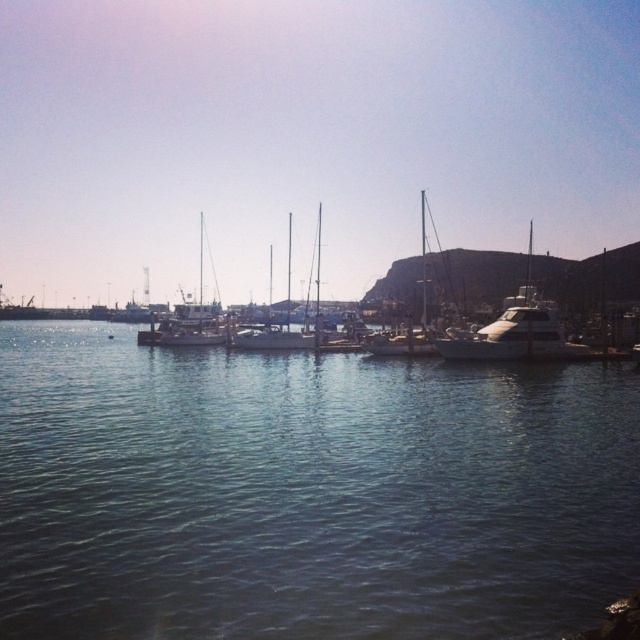
Question: Is clear water at center in front of white glossy yacht at center?

Choices:
 (A) no
 (B) yes

Answer: (B)

Question: Is clear water at center to the left of white glossy yacht at center from the viewer's perspective?

Choices:
 (A) no
 (B) yes

Answer: (B)

Question: Which object is farther from the camera taking this photo?

Choices:
 (A) clear water at center
 (B) white glossy yacht at center

Answer: (B)

Question: Does clear water at center have a larger size compared to white glossy yacht at center?

Choices:
 (A) no
 (B) yes

Answer: (A)

Question: Among these objects, which one is farthest from the camera?

Choices:
 (A) white glossy yacht at center
 (B) clear water at center

Answer: (A)